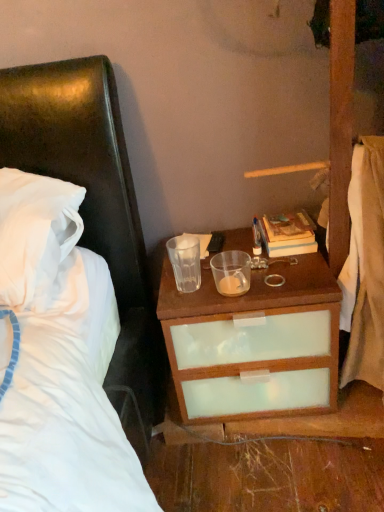
Locate an element on the screen. The width and height of the screenshot is (384, 512). white cotton sheet at right is located at coordinates (365, 267).

Image resolution: width=384 pixels, height=512 pixels. What do you see at coordinates (365, 267) in the screenshot?
I see `white cotton sheet at right` at bounding box center [365, 267].

Identify the location of white cotton sheet at right. This screenshot has width=384, height=512. (365, 267).